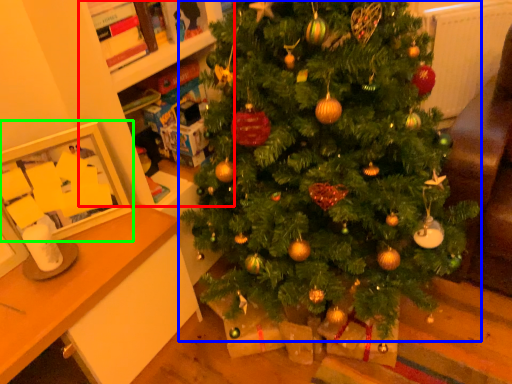
Question: Based on their relative distances, which object is farther from bookshelf (highlighted by a red box)? Choose from christmas tree (highlighted by a blue box) and picture frame (highlighted by a green box).

Choices:
 (A) christmas tree
 (B) picture frame

Answer: (A)